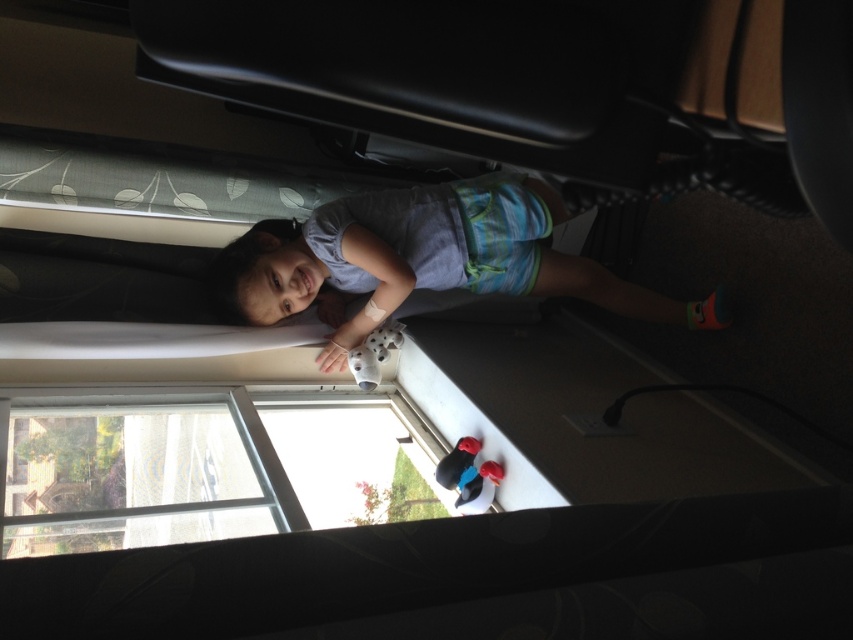
Is light blue cotton shirt at upper center taller than clear glass window at lower left?

Indeed, light blue cotton shirt at upper center has a greater height compared to clear glass window at lower left.

Can you confirm if light blue cotton shirt at upper center is thinner than clear glass window at lower left?

No, light blue cotton shirt at upper center is not thinner than clear glass window at lower left.

This screenshot has width=853, height=640. Find the location of `light blue cotton shirt at upper center`. light blue cotton shirt at upper center is located at coordinates (422, 260).

Can you confirm if clear glass window at lower left is taller than rubberized plastic toy at lower center?

Correct, clear glass window at lower left is much taller as rubberized plastic toy at lower center.

Does clear glass window at lower left have a lesser width compared to rubberized plastic toy at lower center?

No.

Locate an element on the screen. The height and width of the screenshot is (640, 853). clear glass window at lower left is located at coordinates (141, 476).

Who is lower down, light blue cotton shirt at upper center or rubberized plastic toy at lower center?

rubberized plastic toy at lower center is lower down.

Does light blue cotton shirt at upper center have a greater height compared to rubberized plastic toy at lower center?

Indeed, light blue cotton shirt at upper center has a greater height compared to rubberized plastic toy at lower center.

The height and width of the screenshot is (640, 853). Describe the element at coordinates (422, 260) in the screenshot. I see `light blue cotton shirt at upper center` at that location.

Identify the location of light blue cotton shirt at upper center. (422, 260).